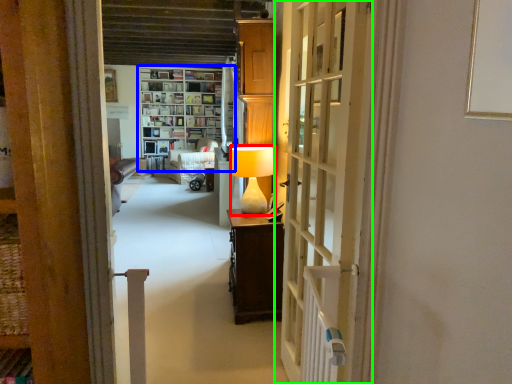
Question: Which is farther away from table lamp (highlighted by a red box)? shelf (highlighted by a blue box) or door (highlighted by a green box)?

Choices:
 (A) shelf
 (B) door

Answer: (A)